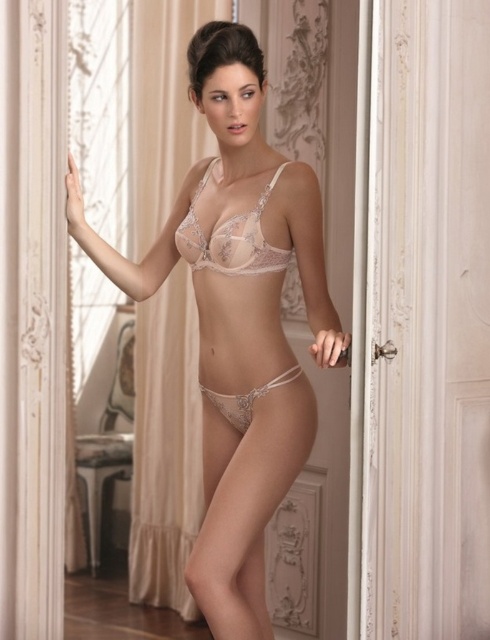
You are a fashion designer preparing for a photoshoot in a luxurious, vintage interior. You have two outfits to choose from displayed in the scene. The first is the translucent lace lingerie at center and the second is the translucent lace bikini at center. Based on their sizes, which outfit would be more appropriate for a photo shoot focusing on elegance and modesty?

The translucent lace lingerie at center is bigger than the translucent lace bikini at center, so it would be more appropriate for a photoshoot focusing on elegance and modesty as it offers more coverage.